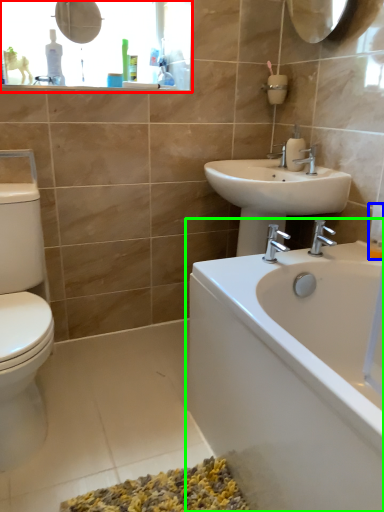
Question: Estimate the real-world distances between objects in this image. Which object is closer to medicine cabinet (highlighted by a red box), toiletry (highlighted by a blue box) or bathtub (highlighted by a green box)?

Choices:
 (A) toiletry
 (B) bathtub

Answer: (B)